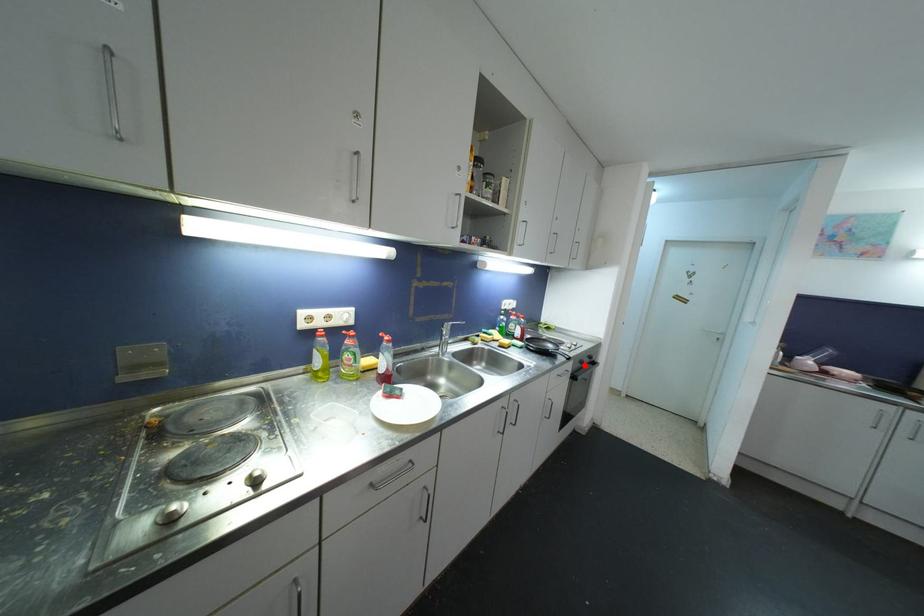
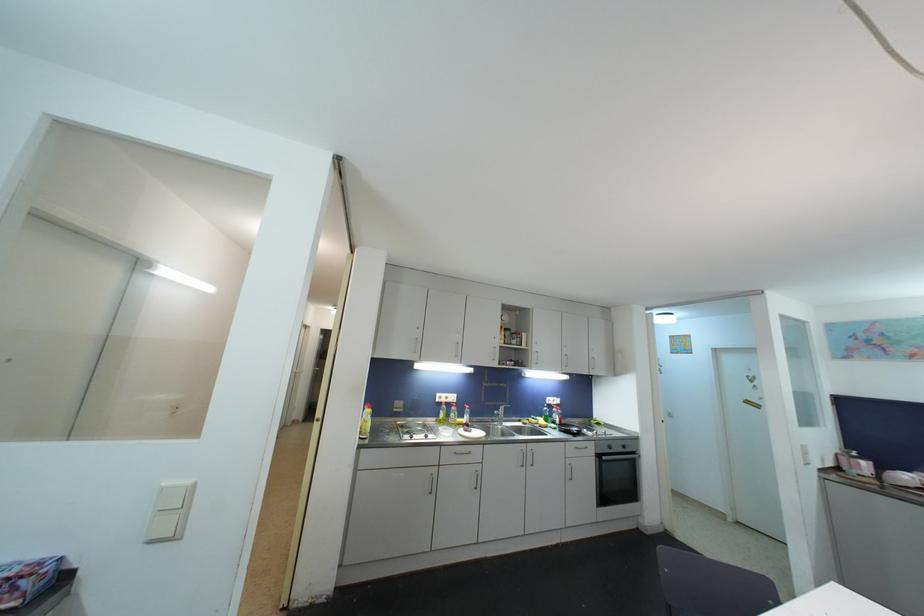
The point at the highlighted location is marked in the first image. Where is the corresponding point in the second image?

(613, 450)